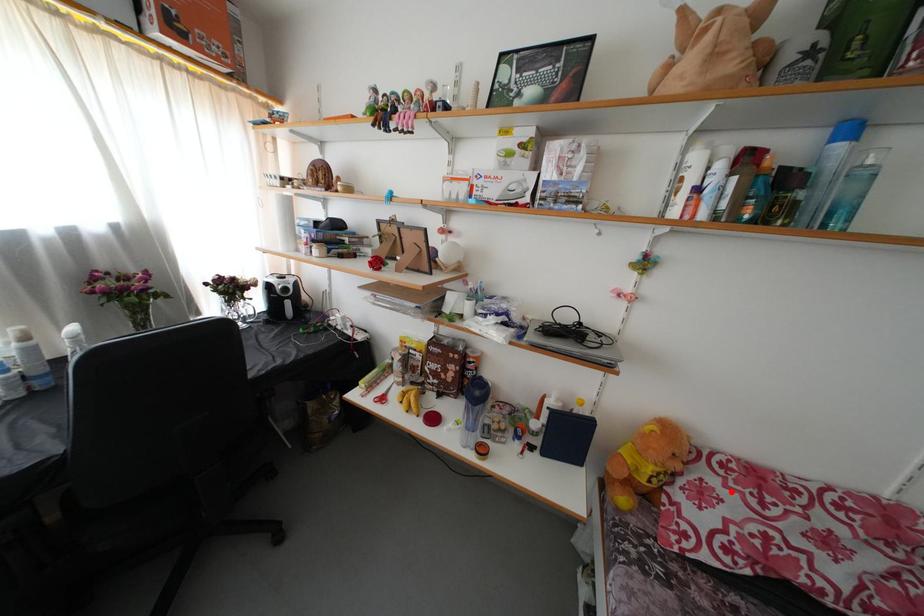
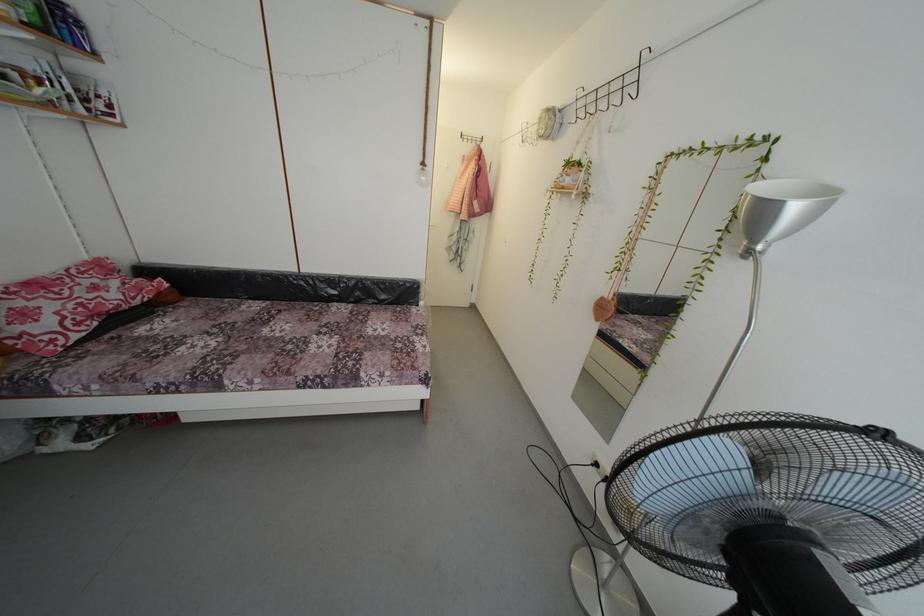
Find the pixel in the second image that matches the highlighted location in the first image.

(34, 306)